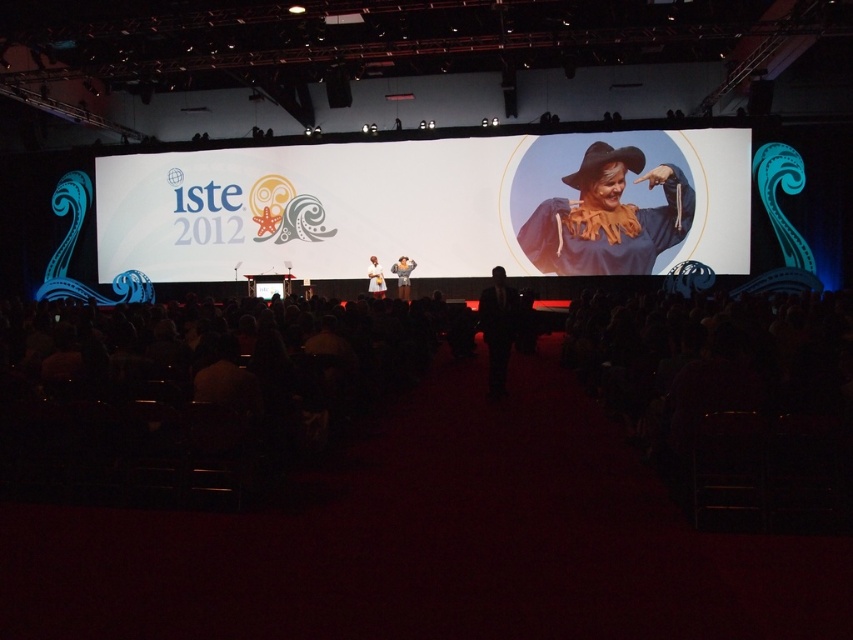
You are standing at the origin point in the coordinate system of the image. You want to walk towards point A at coordinates point (598, 157) and point B at coordinates point (381, 285). Which point will you reach first?

Point B at coordinates point (381, 285) will be reached first because it is closer to the origin than point A at coordinates point (598, 157).

You are an attendee sitting in the audience of the ISTE 2012 event. You notice two points on the stage screen. The first point is at coordinates point (618, 230) and the second is at point (498, 316). If you were to draw a line from your seat to each point, which point would require the line to be longer?

Point (618, 230) is behind point (498, 316), so the line to point (618, 230) would be longer.